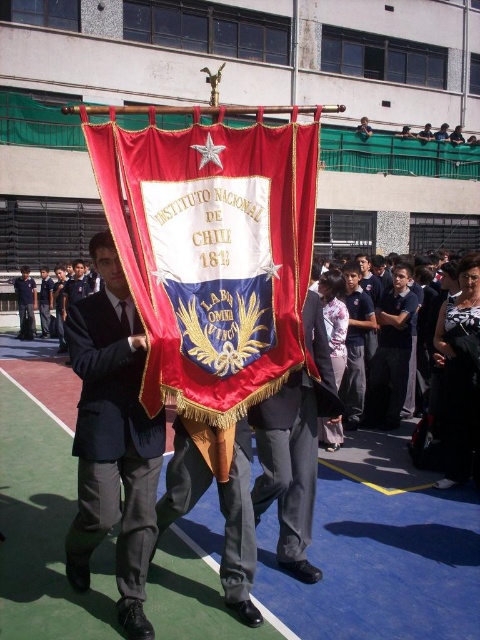
You are a photographer at the event and need to frame a shot that includes both the velvet red flag at center and the dark gray suit at center. Based on their sizes, which object should be placed closer to the edges of the frame to avoid overcrowding?

The velvet red flag at center might be wider than dark gray suit at center, so placing the wider velvet red flag at center near the edge would help prevent overcrowding in the frame.

Based on the photo, you are an event photographer at the school gathering. You need to capture a photo of the dark gray suit at center and the matte black pants at center. Which one appears wider in the photo?

The dark gray suit at center appears wider than the matte black pants at center because its width surpasses the latter.

In the scene shown: You are attending the event and want to take a photo of both the velvet red flag at center and the matte black pants at center. When you look through your camera, which object appears larger in your viewfinder?

The velvet red flag at center appears larger in the viewfinder because it is closer to the viewer than the matte black pants at center.